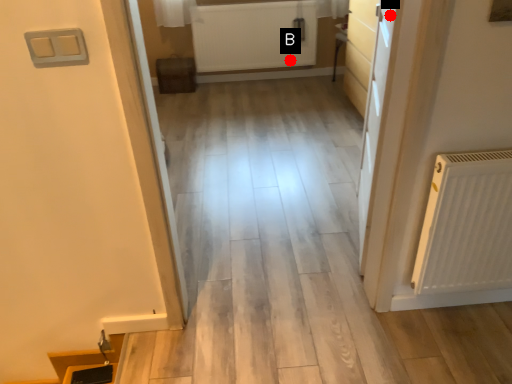
Question: Two points are circled on the image, labeled by A and B beside each circle. Which point is closer to the camera?

Choices:
 (A) A is closer
 (B) B is closer

Answer: (A)